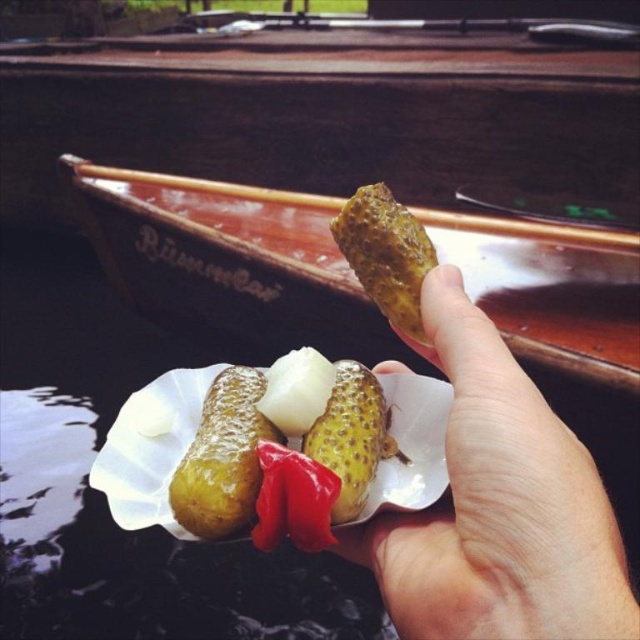
Is yellow matte paper plate at center above shiny golden pickle at center?

No, yellow matte paper plate at center is not above shiny golden pickle at center.

Between point (392, 472) and point (236, 525), which one is positioned in front?

Point (236, 525) is in front.

Does point (176, 381) come farther from viewer compared to point (182, 516)?

Yes, point (176, 381) is behind point (182, 516).

This screenshot has width=640, height=640. Identify the location of yellow matte paper plate at center. (150, 449).

Who is higher up, yellow matte paper plate at center or translucent white pickles at center?

translucent white pickles at center

Is yellow matte paper plate at center to the right of translucent white pickles at center from the viewer's perspective?

No, yellow matte paper plate at center is not to the right of translucent white pickles at center.

Measure the distance between yellow matte paper plate at center and camera.

yellow matte paper plate at center and camera are 22.02 inches apart.

This screenshot has width=640, height=640. I want to click on yellow matte paper plate at center, so click(x=150, y=449).

Does smooth skin hand at center have a smaller size compared to yellow speckled pickle at center?

No, smooth skin hand at center is not smaller than yellow speckled pickle at center.

Is smooth skin hand at center to the right of yellow speckled pickle at center from the viewer's perspective?

Yes, smooth skin hand at center is to the right of yellow speckled pickle at center.

Which is behind, point (580, 625) or point (355, 445)?

Point (355, 445)

This screenshot has width=640, height=640. Find the location of `smooth skin hand at center`. smooth skin hand at center is located at coordinates (499, 506).